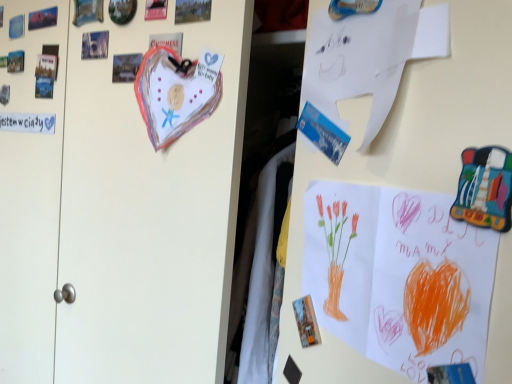
Question: Which is correct: white paper at upper center is inside orange crayon drawing at lower right, or outside of it?

Choices:
 (A) inside
 (B) outside

Answer: (B)

Question: In terms of width, does white paper at upper center look wider or thinner when compared to orange crayon drawing at lower right?

Choices:
 (A) wide
 (B) thin

Answer: (A)

Question: Is point (443, 38) positioned closer to the camera than point (358, 233)?

Choices:
 (A) closer
 (B) farther

Answer: (A)

Question: In the image, is orange crayon drawing at lower right positioned in front of or behind white paper at upper center?

Choices:
 (A) behind
 (B) front

Answer: (B)

Question: Considering the positions of orange crayon drawing at lower right and white paper at upper center in the image, is orange crayon drawing at lower right taller or shorter than white paper at upper center?

Choices:
 (A) short
 (B) tall

Answer: (B)

Question: Considering the positions of point (374, 296) and point (344, 23), is point (374, 296) closer or farther from the camera than point (344, 23)?

Choices:
 (A) farther
 (B) closer

Answer: (B)

Question: From the image's perspective, relative to white paper at upper center, is orange crayon drawing at lower right above or below?

Choices:
 (A) above
 (B) below

Answer: (B)